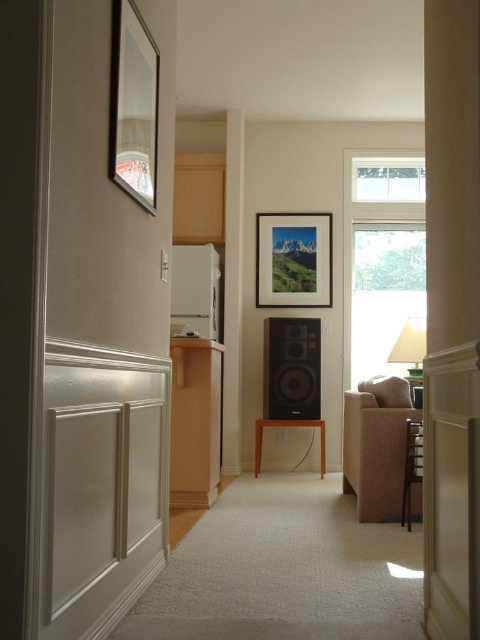
You are arranging furniture in the hallway and want to place a shelf between the matte glass picture frame at center and the black matte speaker at center. Which object should the shelf be placed below to ensure it aligns with their positions?

The shelf should be placed below the matte glass picture frame at center since it is located above the black matte speaker at center, allowing the shelf to align between them.

You are standing in the hallway and want to place a new decorative item between the metallic silver picture frame at upper left and the matte white lampshade at right. Based on their positions, which side should you place it closer to?

You should place the new decorative item closer to the metallic silver picture frame at upper left because it is positioned to the left of the matte white lampshade at right.